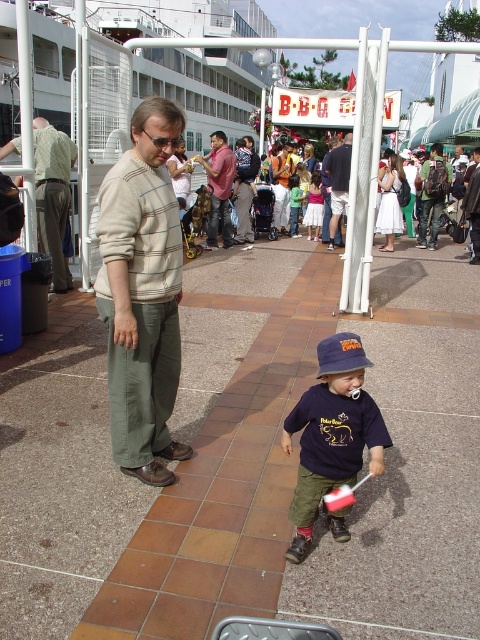
You are a fashion designer observing two sweaters displayed at a market stall. The sweaters are the light beige striped sweater at center and the light brown sweater at center. Which one is taller?

The light beige striped sweater at center is taller than the light brown sweater at center.